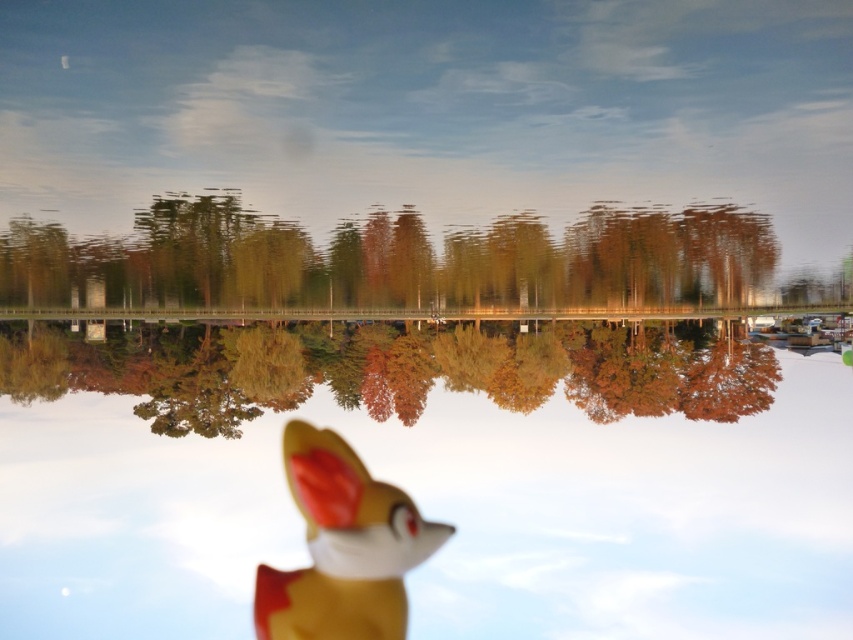
Question: Which of these objects is positioned farthest from the autumn leaves at upper center?

Choices:
 (A) soft yellow plush toy at center
 (B) transparent glass water at center

Answer: (A)

Question: From the image, what is the correct spatial relationship of autumn leaves at upper center in relation to soft yellow plush toy at center?

Choices:
 (A) right
 (B) left

Answer: (A)

Question: Among these objects, which one is nearest to the camera?

Choices:
 (A) transparent glass water at center
 (B) autumn leaves at upper center
 (C) soft yellow plush toy at center

Answer: (B)

Question: Is transparent glass water at center above autumn leaves at upper center?

Choices:
 (A) no
 (B) yes

Answer: (A)

Question: Can you confirm if transparent glass water at center is positioned above soft yellow plush toy at center?

Choices:
 (A) yes
 (B) no

Answer: (A)

Question: Which object is closer to the camera taking this photo?

Choices:
 (A) autumn leaves at upper center
 (B) transparent glass water at center
 (C) soft yellow plush toy at center

Answer: (A)